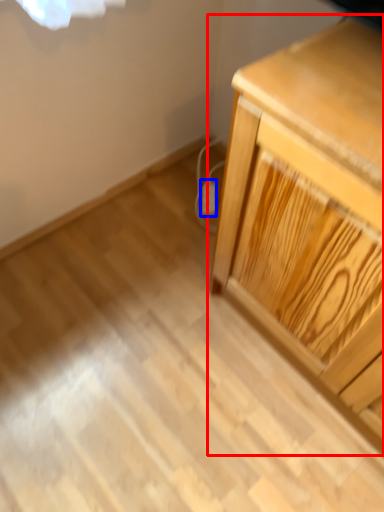
Question: Which object appears farthest to the camera in this image, chest of drawers (highlighted by a red box) or electric outlet (highlighted by a blue box)?

Choices:
 (A) chest of drawers
 (B) electric outlet

Answer: (B)